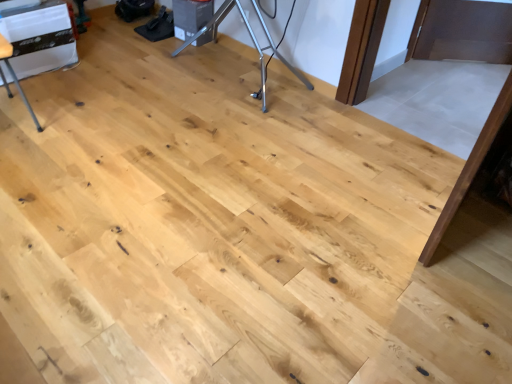
Where is `matte white appliance at left`? The width and height of the screenshot is (512, 384). matte white appliance at left is located at coordinates (15, 76).

Image resolution: width=512 pixels, height=384 pixels. What are the coordinates of `white plastic table at upper left` in the screenshot? It's located at (39, 37).

Looking at this image, from the image's perspective, is matte white appliance at left located above or below silver metallic tripod at center?

matte white appliance at left is below silver metallic tripod at center.

Based on the photo, what's the angular difference between matte white appliance at left and silver metallic tripod at center's facing directions?

85.3 degrees.

From a real-world perspective, between matte white appliance at left and silver metallic tripod at center, who is vertically higher?

matte white appliance at left.

From the image's perspective, is silver metallic tripod at center below white plastic table at upper left?

No, from the image's perspective, silver metallic tripod at center is not beneath white plastic table at upper left.

Does silver metallic tripod at center have a larger size compared to white plastic table at upper left?

Incorrect, silver metallic tripod at center is not larger than white plastic table at upper left.

Considering the sizes of objects silver metallic tripod at center and white plastic table at upper left in the image provided, who is thinner, silver metallic tripod at center or white plastic table at upper left?

Thinner between the two is silver metallic tripod at center.

Is white plastic table at upper left to the left or to the right of matte white appliance at left in the image?

In the image, white plastic table at upper left appears on the left side of matte white appliance at left.

Is white plastic table at upper left inside or outside of matte white appliance at left?

white plastic table at upper left is located beyond the bounds of matte white appliance at left.

Considering the relative sizes of white plastic table at upper left and matte white appliance at left in the image provided, is white plastic table at upper left thinner than matte white appliance at left?

In fact, white plastic table at upper left might be wider than matte white appliance at left.

The image size is (512, 384). I want to click on tripod behind the white plastic table at upper left, so click(x=253, y=42).

Which is in front, point (70, 37) or point (213, 16)?

The point (70, 37) is closer to the camera.

Considering the positions of objects white plastic table at upper left and silver metallic tripod at center in the image provided, who is more to the left, white plastic table at upper left or silver metallic tripod at center?

Positioned to the left is white plastic table at upper left.

Is silver metallic tripod at center next to matte white appliance at left and touching it?

silver metallic tripod at center and matte white appliance at left are clearly separated.

What's the angular difference between silver metallic tripod at center and matte white appliance at left's facing directions?

There is a 85.3-degree angle between the facing directions of silver metallic tripod at center and matte white appliance at left.

Is silver metallic tripod at center outside of matte white appliance at left?

Absolutely, silver metallic tripod at center is external to matte white appliance at left.

At what (x,y) coordinates should I click in order to perform the action: click on furniture located below the silver metallic tripod at center (from the image's perspective). Please return your answer as a coordinate pair (x, y). Looking at the image, I should click on (15, 76).

Is matte white appliance at left situated inside white plastic table at upper left or outside?

matte white appliance at left exists outside the volume of white plastic table at upper left.

You are a GUI agent. You are given a task and a screenshot of the screen. Output one action in this format:
    pyautogui.click(x=<x>, y=<y>)
    Task: Click on the furniture above the white plastic table at upper left (from a real-world perspective)
    
    Given the screenshot: What is the action you would take?
    pyautogui.click(x=15, y=76)

Is matte white appliance at left oriented towards white plastic table at upper left?

No, matte white appliance at left is not turned towards white plastic table at upper left.

Which of these two, matte white appliance at left or white plastic table at upper left, is wider?

Wider between the two is white plastic table at upper left.

Where is `tripod that is above the matte white appliance at left (from the image's perspective)`? tripod that is above the matte white appliance at left (from the image's perspective) is located at coordinates (253, 42).

Identify the location of table below the silver metallic tripod at center (from the image's perspective). The height and width of the screenshot is (384, 512). (39, 37).

Which object lies nearer to the anchor point silver metallic tripod at center, white plastic table at upper left or matte white appliance at left?

white plastic table at upper left is positioned closer to the anchor silver metallic tripod at center.

From the image, which object appears to be farther from white plastic table at upper left, silver metallic tripod at center or matte white appliance at left?

silver metallic tripod at center.

Estimate the real-world distances between objects in this image. Which object is closer to white plastic table at upper left, matte white appliance at left or silver metallic tripod at center?

matte white appliance at left.

Based on their spatial positions, is white plastic table at upper left or silver metallic tripod at center further from matte white appliance at left?

silver metallic tripod at center lies further to matte white appliance at left than the other object.

Based on their spatial positions, is silver metallic tripod at center or white plastic table at upper left further from matte white appliance at left?

silver metallic tripod at center.

Looking at the image, which one is located further to silver metallic tripod at center, matte white appliance at left or white plastic table at upper left?

Based on the image, matte white appliance at left appears to be further to silver metallic tripod at center.

Image resolution: width=512 pixels, height=384 pixels. I want to click on furniture situated between white plastic table at upper left and silver metallic tripod at center from left to right, so click(15, 76).